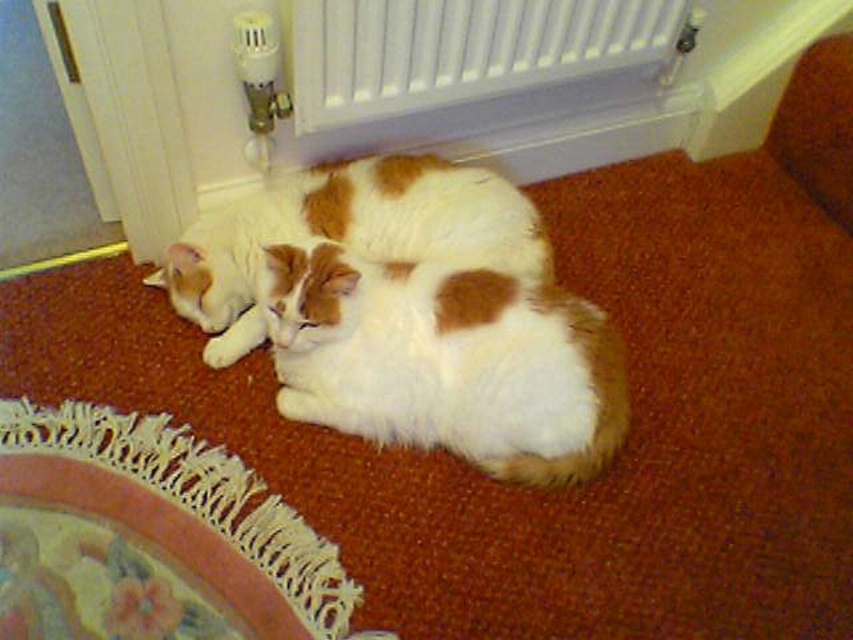
You are a photographer setting up a shot of the two cats. You want to ensure the white plastic radiator at upper center and the white soft fur cat at center are both in frame. From the cat, which direction should you move the camera to include the radiator?

The white plastic radiator at upper center is positioned on the right side of the white soft fur cat at center, so you should move the camera to the right to include the radiator.

You are a photographer trying to capture the white fluffy cat at center. The camera can only focus on objects within a 0.1 radius of the point marked at coordinates point (445, 362). Is the white fluffy cat at center within the camera focus range?

The point (445, 362) marks the white fluffy cat at center, so yes, the cat is within the camera focus range since the focus area includes the marked point.

You are a cat owner trying to place a heating pad for your cats. The heating pad is 10 cm tall. You see the white fluffy cat at center and the white soft fur cat at center. Which cat can the heating pad fit under without being too tall?

The heating pad can fit under the white fluffy cat at center because it has a lesser height compared to the white soft fur cat at center, making the heating pad appropriately sized for the white fluffy cat at center.